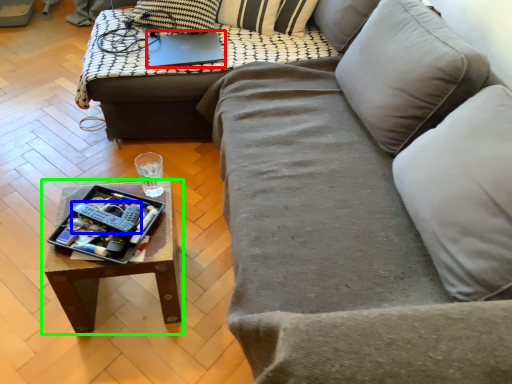
Question: Considering the real-world distances, which object is farthest from laptop (highlighted by a red box)? remote (highlighted by a blue box) or coffee table (highlighted by a green box)?

Choices:
 (A) remote
 (B) coffee table

Answer: (A)